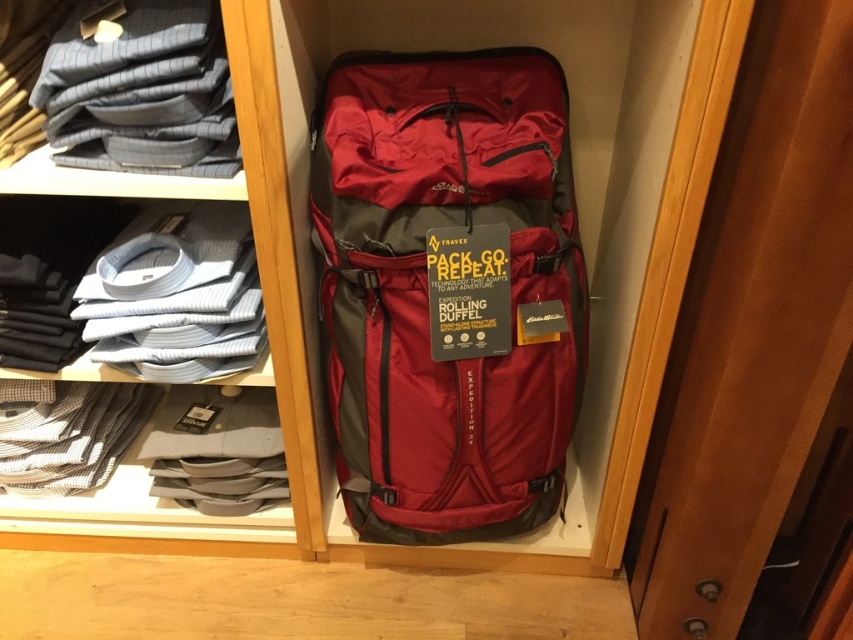
Who is higher up, matte red duffel bag at center or matte gray shirts at left?

matte red duffel bag at center is higher up.

Can you confirm if matte red duffel bag at center is shorter than matte gray shirts at left?

Correct, matte red duffel bag at center is not as tall as matte gray shirts at left.

The width and height of the screenshot is (853, 640). In order to click on matte red duffel bag at center in this screenshot , I will do `click(448, 289)`.

Can you confirm if matte red duffel bag at center is smaller than gray striped shirt at upper left?

No, matte red duffel bag at center is not smaller than gray striped shirt at upper left.

Does matte red duffel bag at center have a lesser width compared to gray striped shirt at upper left?

In fact, matte red duffel bag at center might be wider than gray striped shirt at upper left.

The image size is (853, 640). In order to click on matte red duffel bag at center in this screenshot , I will do `click(448, 289)`.

Is matte gray shirts at left closer to camera compared to gray striped shirt at upper left?

Yes, it is in front of gray striped shirt at upper left.

Is matte gray shirts at left thinner than gray striped shirt at upper left?

In fact, matte gray shirts at left might be wider than gray striped shirt at upper left.

The image size is (853, 640). I want to click on matte gray shirts at left, so click(x=263, y=301).

Locate an element on the screen. The width and height of the screenshot is (853, 640). matte gray shirts at left is located at coordinates (263, 301).